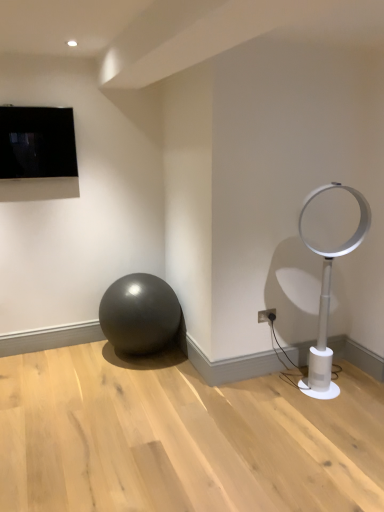
This screenshot has width=384, height=512. Identify the location of free space in front of white plastic fan at right. (341, 413).